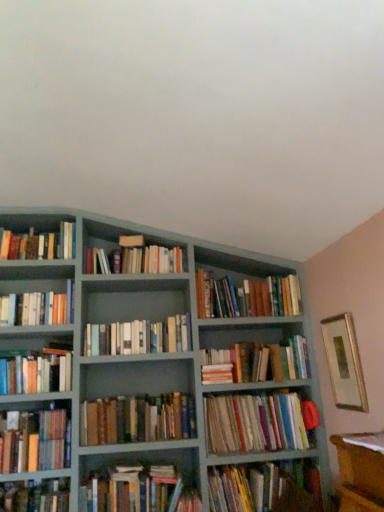
Locate an element on the screen. The width and height of the screenshot is (384, 512). brown leather book at center, marked as the 6th book in a bottom-to-top arrangement is located at coordinates (137, 419).

The image size is (384, 512). Identify the location of hardcover books at lower left, the ninth book in the top-to-bottom sequence. (35, 441).

Measure the distance between hardcover book at lower left, which is the 13th book in top-to-bottom order, and camera.

The distance of hardcover book at lower left, which is the 13th book in top-to-bottom order, from camera is 2.22 meters.

Describe the element at coordinates (247, 297) in the screenshot. Image resolution: width=384 pixels, height=512 pixels. I see `hardcover books at center, which is counted as the eleventh book, starting from the bottom` at that location.

This screenshot has width=384, height=512. I want to click on hardcover books at left, the seventh book positioned from the top, so click(36, 372).

Measure the distance between point (x=29, y=373) and camera.

Point (x=29, y=373) and camera are 2.44 meters apart from each other.

Where is `brown leather book at center, which is the 8th book in top-to-bottom order`? The width and height of the screenshot is (384, 512). brown leather book at center, which is the 8th book in top-to-bottom order is located at coordinates (137, 419).

Does hardcover books at center, which is counted as the eleventh book, starting from the bottom, have a greater height compared to matte gray bookcase at center?

In fact, hardcover books at center, which is counted as the eleventh book, starting from the bottom, may be shorter than matte gray bookcase at center.

Is hardcover books at center, which is counted as the eleventh book, starting from the bottom, to the right of matte gray bookcase at center from the viewer's perspective?

Yes.

Is hardcover books at center, which is counted as the eleventh book, starting from the bottom, surrounding matte gray bookcase at center?

Actually, matte gray bookcase at center is outside hardcover books at center, which is counted as the eleventh book, starting from the bottom.

Looking at this image, considering the positions of objects hardcover books at center, positioned as the 3th book in top-to-bottom order, and matte gray bookcase at center in the image provided, who is in front, hardcover books at center, positioned as the 3th book in top-to-bottom order, or matte gray bookcase at center?

matte gray bookcase at center is closer to the camera.

Are hardcover books at center, which is counted as the eleventh book, starting from the bottom, and hardcover books at left, the tenth book from the bottom, far apart?

Yes, hardcover books at center, which is counted as the eleventh book, starting from the bottom, and hardcover books at left, the tenth book from the bottom, are located far from each other.

Is hardcover books at center, positioned as the 3th book in top-to-bottom order, inside or outside of hardcover books at left, the tenth book from the bottom?

The correct answer is: outside.

Can you confirm if hardcover books at center, positioned as the 3th book in top-to-bottom order, is wider than hardcover books at left, which is the fourth book in top-to-bottom order?

Correct, the width of hardcover books at center, positioned as the 3th book in top-to-bottom order, exceeds that of hardcover books at left, which is the fourth book in top-to-bottom order.

Considering the sizes of hardcover books at center, positioned as the 3th book in top-to-bottom order, and hardcover books at left, which is the fourth book in top-to-bottom order, in the image, is hardcover books at center, positioned as the 3th book in top-to-bottom order, bigger or smaller than hardcover books at left, which is the fourth book in top-to-bottom order,?

Considering their sizes, hardcover books at center, positioned as the 3th book in top-to-bottom order, takes up more space than hardcover books at left, which is the fourth book in top-to-bottom order.

The width and height of the screenshot is (384, 512). Identify the location of book that is the 7th one when counting leftward from the hardcover books at center, positioned as the 3th book in top-to-bottom order. (36, 372).

Who is more distant, hardcover books at center, positioned as the 3th book in top-to-bottom order, or hardcover books at left, the seventh book positioned from the top?

Positioned behind is hardcover books at center, positioned as the 3th book in top-to-bottom order.

Considering the relative sizes of hardcover books at center, positioned as the 3th book in top-to-bottom order, and hardcover books at left, the seventh book positioned from the top, in the image provided, is hardcover books at center, positioned as the 3th book in top-to-bottom order, taller than hardcover books at left, the seventh book positioned from the top,?

In fact, hardcover books at center, positioned as the 3th book in top-to-bottom order, may be shorter than hardcover books at left, the seventh book positioned from the top.

Is hardcover books at lower center, the 2th book when ordered from bottom to top, not inside hardcover books at left, which is the fourth book in top-to-bottom order?

Indeed, hardcover books at lower center, the 2th book when ordered from bottom to top, is completely outside hardcover books at left, which is the fourth book in top-to-bottom order.

Who is smaller, hardcover books at lower center, the 2th book when ordered from bottom to top, or hardcover books at left, which is the fourth book in top-to-bottom order?

Smaller between the two is hardcover books at lower center, the 2th book when ordered from bottom to top.

Considering the sizes of hardcover books at lower center, the 2th book when ordered from bottom to top, and hardcover books at left, which is the fourth book in top-to-bottom order, in the image, is hardcover books at lower center, the 2th book when ordered from bottom to top, wider or thinner than hardcover books at left, which is the fourth book in top-to-bottom order,?

In the image, hardcover books at lower center, the 2th book when ordered from bottom to top, appears to be wider than hardcover books at left, which is the fourth book in top-to-bottom order.

How different are the orientations of hardcover books at lower center, acting as the twelfth book starting from the top, and hardcover books at left, the tenth book from the bottom, in degrees?

There is a 0.7-degree angle between the facing directions of hardcover books at lower center, acting as the twelfth book starting from the top, and hardcover books at left, the tenth book from the bottom.

Does hardcover books at center, positioned as the ninth book in bottom-to-top order, turn towards hardcover books at center, which is counted as the eleventh book, starting from the bottom?

No, hardcover books at center, positioned as the ninth book in bottom-to-top order, is not aimed at hardcover books at center, which is counted as the eleventh book, starting from the bottom.

From a real-world perspective, who is located higher, hardcover books at center, positioned as the ninth book in bottom-to-top order, or hardcover books at center, which is counted as the eleventh book, starting from the bottom?

hardcover books at center, which is counted as the eleventh book, starting from the bottom, from a real-world perspective.

Does hardcover books at center, positioned as the ninth book in bottom-to-top order, touch hardcover books at center, which is counted as the eleventh book, starting from the bottom?

They are not placed beside each other.

Is hardcover books at lower center, the 2th book when ordered from bottom to top, located within multicolored paperbacks at center, the 4th book positioned from the bottom?

No, hardcover books at lower center, the 2th book when ordered from bottom to top, is located outside of multicolored paperbacks at center, the 4th book positioned from the bottom.

Considering the relative positions of multicolored paperbacks at center, the 4th book positioned from the bottom, and hardcover books at lower center, the 2th book when ordered from bottom to top, in the image provided, is multicolored paperbacks at center, the 4th book positioned from the bottom, in front of hardcover books at lower center, the 2th book when ordered from bottom to top,?

That is False.

From a real-world perspective, is multicolored paperbacks at center, the 4th book positioned from the bottom, located beneath hardcover books at lower center, acting as the twelfth book starting from the top?

Actually, multicolored paperbacks at center, the 4th book positioned from the bottom, is physically above hardcover books at lower center, acting as the twelfth book starting from the top, in the real world.

From the image's perspective, is multicolored paperbacks at center, which is counted as the tenth book, starting from the top, positioned above or below hardcover books at lower center, acting as the twelfth book starting from the top?

multicolored paperbacks at center, which is counted as the tenth book, starting from the top, is situated higher than hardcover books at lower center, acting as the twelfth book starting from the top, in the image.

Considering the relative positions of hardcover books at lower center, acting as the twelfth book starting from the top, and hardcover books at center, which is counted as the eleventh book, starting from the bottom, in the image provided, is hardcover books at lower center, acting as the twelfth book starting from the top, to the left or to the right of hardcover books at center, which is counted as the eleventh book, starting from the bottom,?

In the image, hardcover books at lower center, acting as the twelfth book starting from the top, appears on the right side of hardcover books at center, which is counted as the eleventh book, starting from the bottom.

Can you confirm if hardcover books at lower center, the 2th book when ordered from bottom to top, is wider than hardcover books at center, which is counted as the eleventh book, starting from the bottom?

No.

How many degrees apart are the facing directions of hardcover books at lower center, acting as the twelfth book starting from the top, and hardcover books at center, positioned as the 3th book in top-to-bottom order?

The facing directions of hardcover books at lower center, acting as the twelfth book starting from the top, and hardcover books at center, positioned as the 3th book in top-to-bottom order, are 1.24 degrees apart.

Can you see hardcover books at lower center, the 2th book when ordered from bottom to top, touching hardcover books at center, positioned as the 3th book in top-to-bottom order?

No, hardcover books at lower center, the 2th book when ordered from bottom to top, is not making contact with hardcover books at center, positioned as the 3th book in top-to-bottom order.

Where is `bookcase in front of the hardcover books at center, which is counted as the eleventh book, starting from the bottom`? bookcase in front of the hardcover books at center, which is counted as the eleventh book, starting from the bottom is located at coordinates (167, 368).

Find the location of a particular element. the 8th book to the right of the hardcover books at left, the tenth book from the bottom, starting your count from the anchor is located at coordinates (247, 297).

Which object lies nearer to the anchor point hardcover books at upper left, which is counted as the 1th book, starting from the top, hardcover books at lower center, acting as the twelfth book starting from the top, or multicolored paperbacks at center, which is counted as the tenth book, starting from the top?

multicolored paperbacks at center, which is counted as the tenth book, starting from the top, lies closer to hardcover books at upper left, which is counted as the 1th book, starting from the top, than the other object.

From the image, which object appears to be nearer to brown leather book at center, marked as the 6th book in a bottom-to-top arrangement, hardcover books at left, which is the fourth book in top-to-bottom order, or hardcover books at center, placed as the sixth book when sorted from top to bottom?

hardcover books at center, placed as the sixth book when sorted from top to bottom, is positioned closer to the anchor brown leather book at center, marked as the 6th book in a bottom-to-top arrangement.

When comparing their distances from hardcover books at lower center, the 2th book when ordered from bottom to top, does hardcover books at upper left, which is counted as the 1th book, starting from the top, or hardcover books at center, positioned as the ninth book in bottom-to-top order, seem further?

hardcover books at upper left, which is counted as the 1th book, starting from the top.

Considering their positions, is hardcover books at center, the 3th book in the bottom-to-top sequence, positioned further to multicolored paperbacks at center, the 4th book positioned from the bottom, than hardcover books at lower center, acting as the twelfth book starting from the top?

hardcover books at center, the 3th book in the bottom-to-top sequence, lies further to multicolored paperbacks at center, the 4th book positioned from the bottom, than the other object.

Based on their spatial positions, is hardcover books at lower center, the 2th book when ordered from bottom to top, or hardcover book at lower left, which is the 1th book in bottom-to-top order, closer to hardcover books at upper left, which is counted as the 13th book, starting from the bottom?

hardcover book at lower left, which is the 1th book in bottom-to-top order, is closer to hardcover books at upper left, which is counted as the 13th book, starting from the bottom.

Estimate the real-world distances between objects in this image. Which object is closer to hardcover books at center, which is counted as the eleventh book, starting from the bottom, hardcover books at left, the seventh book positioned from the top, or hardcover books at upper left, which is counted as the 1th book, starting from the top?

hardcover books at upper left, which is counted as the 1th book, starting from the top, is closer to hardcover books at center, which is counted as the eleventh book, starting from the bottom.

Based on their spatial positions, is hardcover books at upper left, which is counted as the 13th book, starting from the bottom, or gold-framed picture at right closer to hardcover books at center, which appears as the eleventh book when viewed from the top?

gold-framed picture at right.

Which object lies nearer to the anchor point gold-framed picture at right, hardcover books at lower left, the ninth book in the top-to-bottom sequence, or hardcover books at center, positioned as the ninth book in bottom-to-top order?

Among the two, hardcover books at center, positioned as the ninth book in bottom-to-top order, is located nearer to gold-framed picture at right.

You are a GUI agent. You are given a task and a screenshot of the screen. Output one action in this format:
    pyautogui.click(x=<x>, y=<y>)
    Task: Click on the bookcase between hardcover books at left, which ranks as the seventh book in bottom-to-top order, and hardcover books at lower center, acting as the twelfth book starting from the top, in the horizontal direction
    This screenshot has width=384, height=512.
    Given the screenshot: What is the action you would take?
    pyautogui.click(x=167, y=368)

Identify the location of bookcase between brown leather book at center, marked as the 6th book in a bottom-to-top arrangement, and multicolored paperbacks at center, the 4th book positioned from the bottom, from left to right. This screenshot has height=512, width=384. (167, 368).

Where is `bookcase between hardcover books at upper center, the 12th book when ordered from bottom to top, and hardcover books at center, positioned as the 3th book in top-to-bottom order, in the horizontal direction`? bookcase between hardcover books at upper center, the 12th book when ordered from bottom to top, and hardcover books at center, positioned as the 3th book in top-to-bottom order, in the horizontal direction is located at coordinates (167, 368).

Image resolution: width=384 pixels, height=512 pixels. I want to click on bookcase between hardcover books at center, positioned as the 3th book in top-to-bottom order, and hardcover books at lower center, acting as the twelfth book starting from the top, vertically, so click(x=167, y=368).